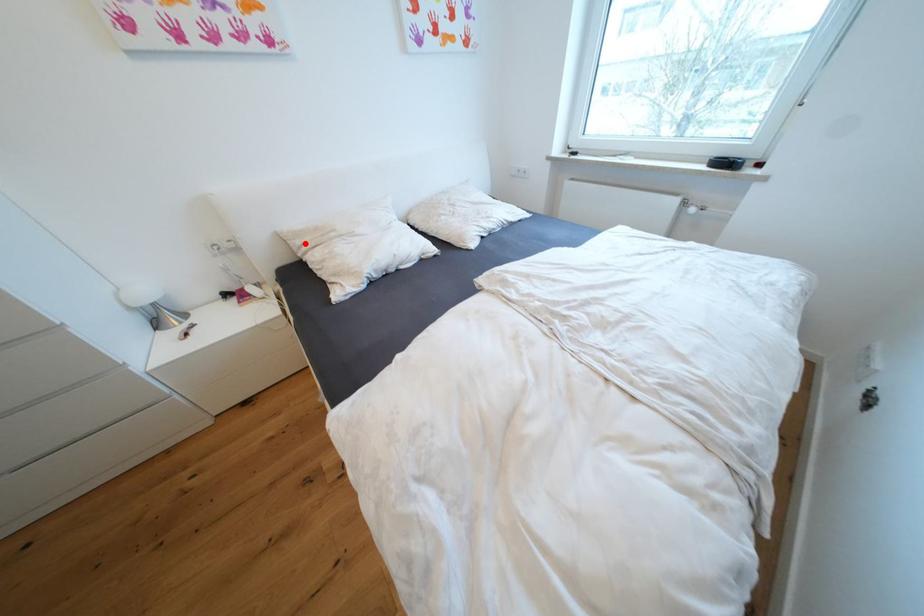
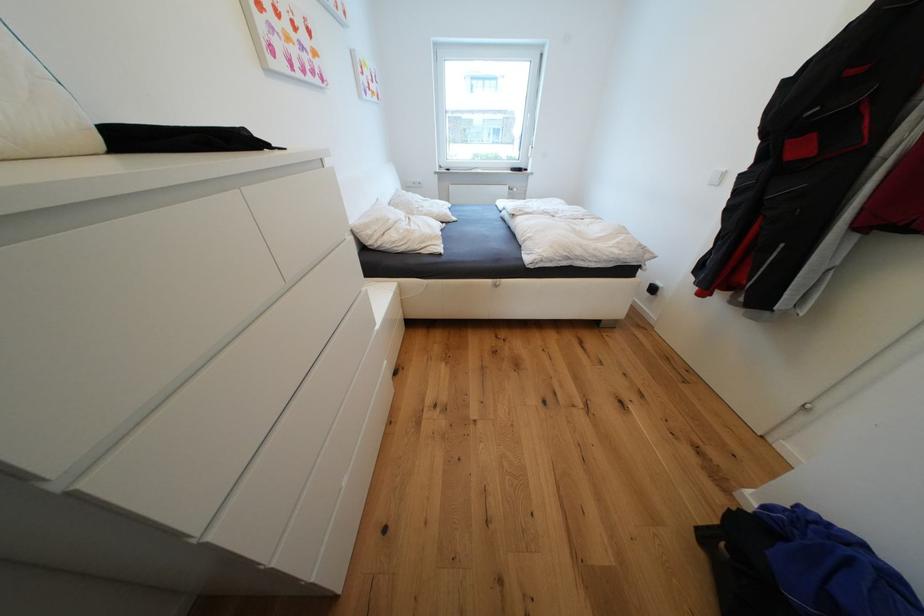
Question: I am providing you with two images of the same scene from different viewpoints. In image1, a red point is highlighted. Considering the same 3D point in image2, which of the following is correct?

Choices:
 (A) It is closer
 (B) It is farther

Answer: (A)